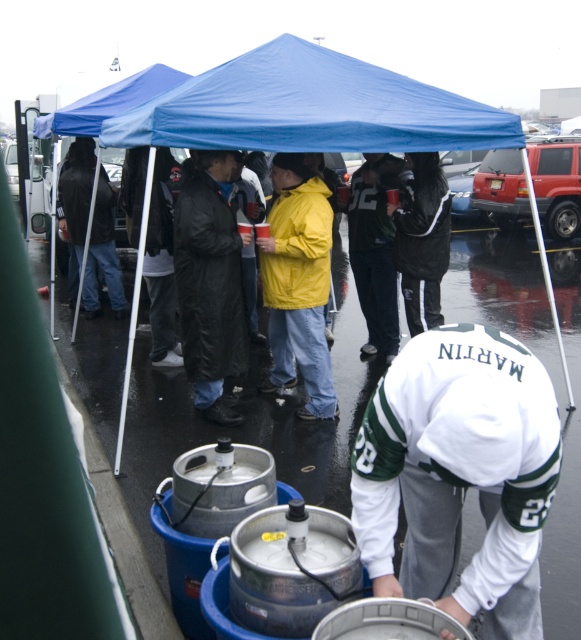
Is blue fabric canopy at upper center in front of black leather jacket at center?

Yes, blue fabric canopy at upper center is in front of black leather jacket at center.

Image resolution: width=581 pixels, height=640 pixels. Describe the element at coordinates (310, 108) in the screenshot. I see `blue fabric canopy at upper center` at that location.

Locate an element on the screen. The width and height of the screenshot is (581, 640). blue fabric canopy at upper center is located at coordinates (310, 108).

Measure the distance between point (213, 230) and camera.

The distance of point (213, 230) from camera is 15.53 feet.

Is point (191, 252) in front of point (285, 236)?

Yes, point (191, 252) is in front of point (285, 236).

Locate an element on the screen. black leather coat at center is located at coordinates (209, 280).

Based on the photo, between black leather coat at center and black matte jacket at center, which one appears on the left side from the viewer's perspective?

black leather coat at center is more to the left.

From the picture: Is black leather coat at center wider than black matte jacket at center?

Yes.

Does point (216, 193) come behind point (431, 195)?

No.

Locate an element on the screen. This screenshot has width=581, height=640. black leather coat at center is located at coordinates (209, 280).